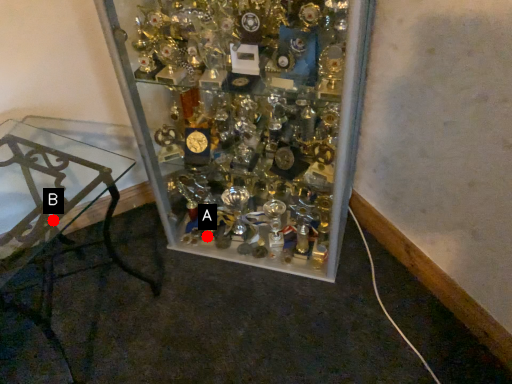
Question: Two points are circled on the image, labeled by A and B beside each circle. Which point is closer to the camera?

Choices:
 (A) A is closer
 (B) B is closer

Answer: (B)